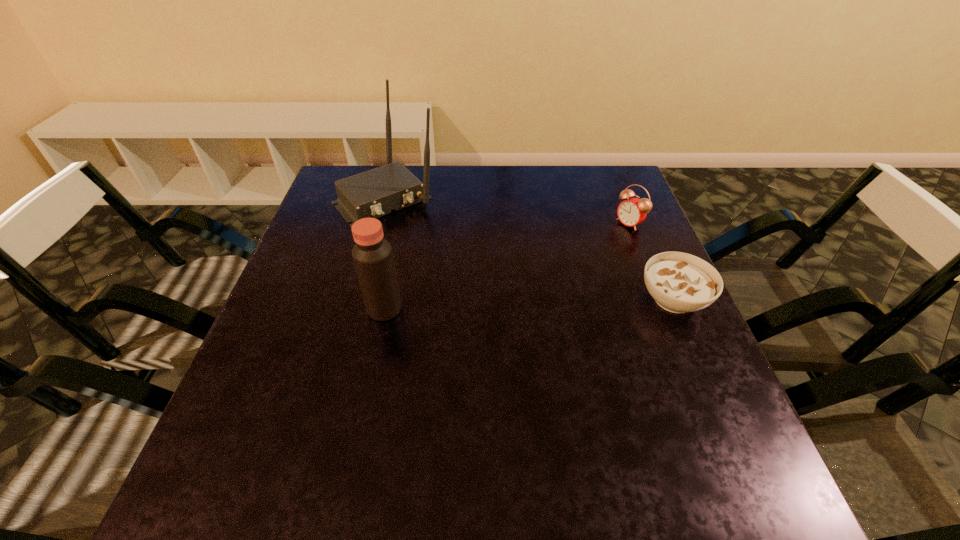
Locate an element on the screen. The height and width of the screenshot is (540, 960). free space on the desktop that is between the third shortest object and the shortest object and is positioned on the clock face of the second shortest object is located at coordinates (487, 306).

This screenshot has height=540, width=960. In order to click on free space on the desktop that is between the vinegar and the shortest object and is positioned on the back of the tallest object to connect cables in this screenshot , I will do `click(489, 305)`.